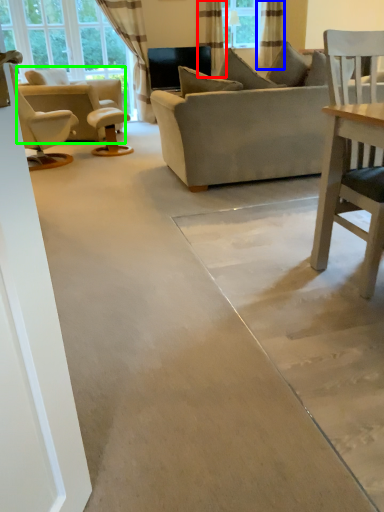
Question: Estimate the real-world distances between objects in this image. Which object is farther from curtain (highlighted by a red box), curtain (highlighted by a blue box) or chair (highlighted by a green box)?

Choices:
 (A) curtain
 (B) chair

Answer: (B)